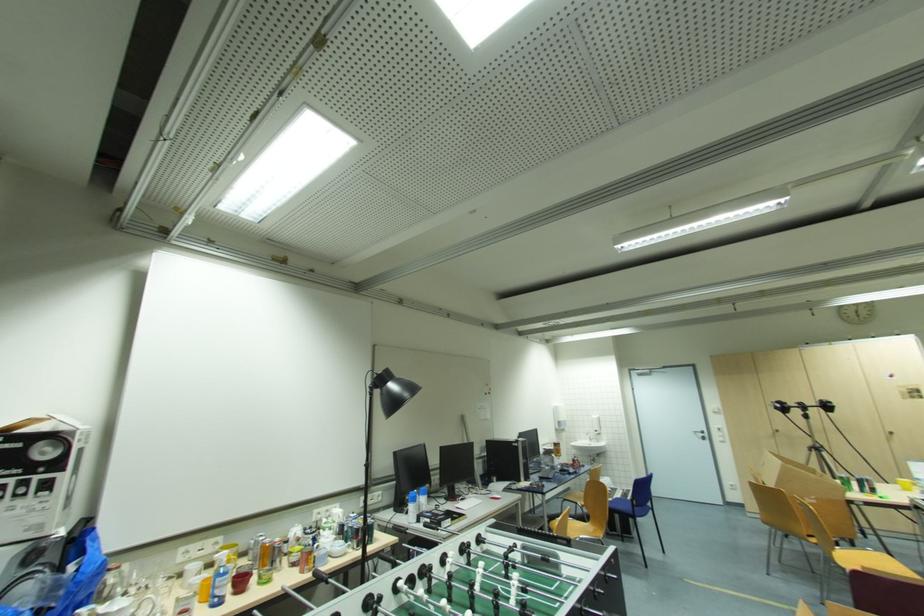
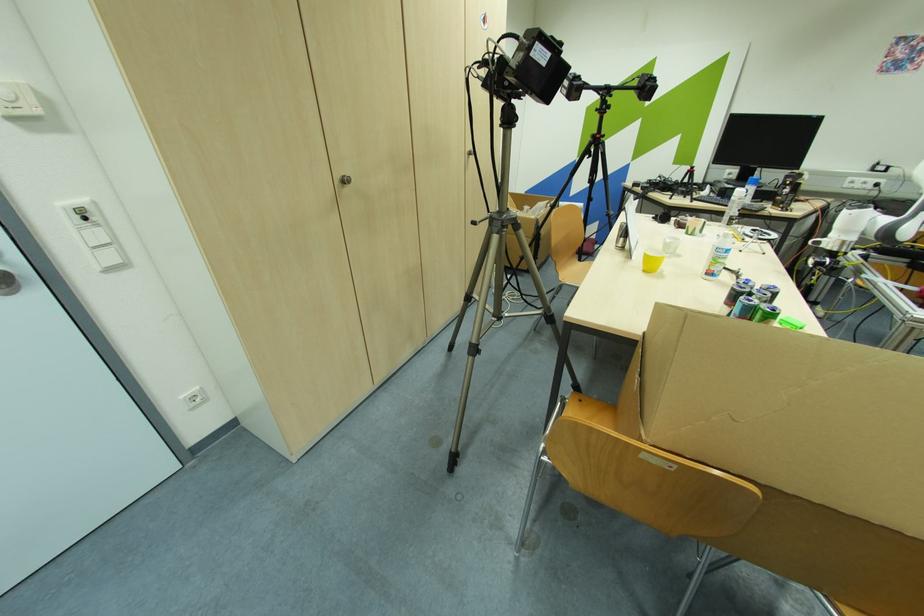
In the second image, find the point that corresponds to point 723,435 in the first image.

(102, 236)